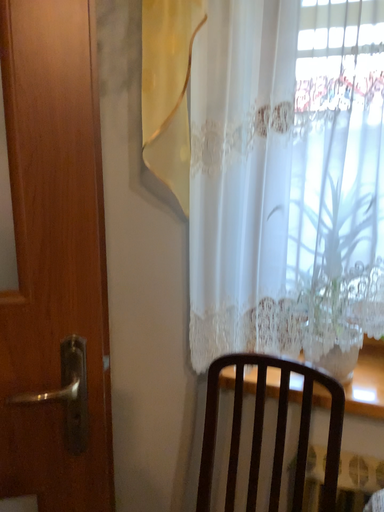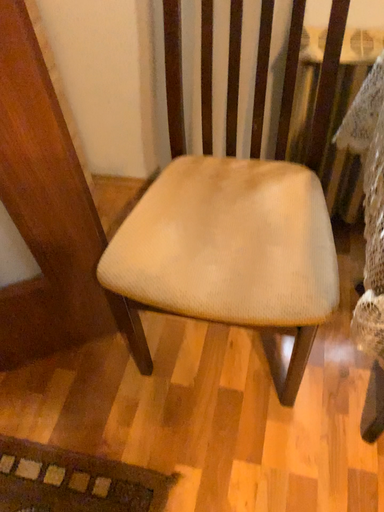
Question: Which way did the camera rotate in the video?

Choices:
 (A) rotated right
 (B) rotated left

Answer: (A)